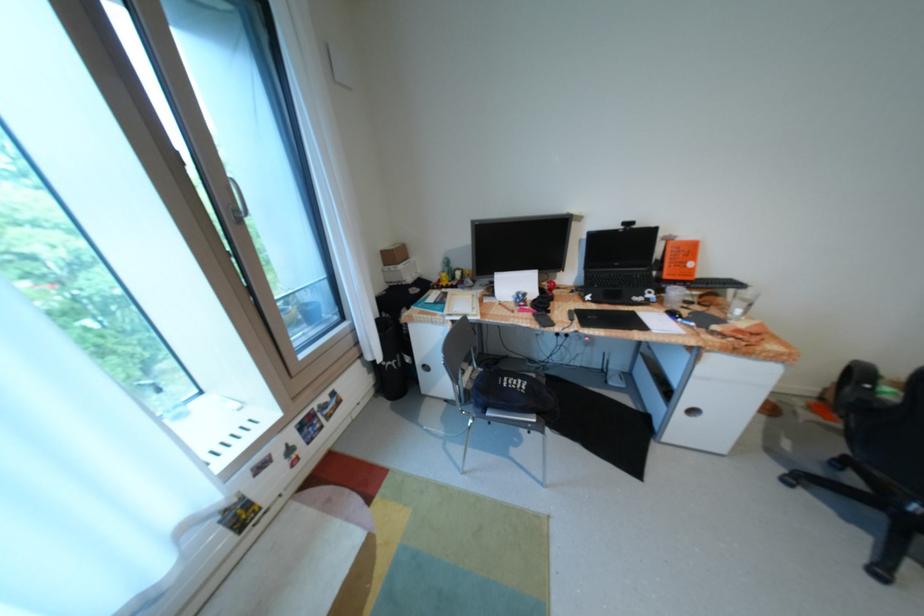
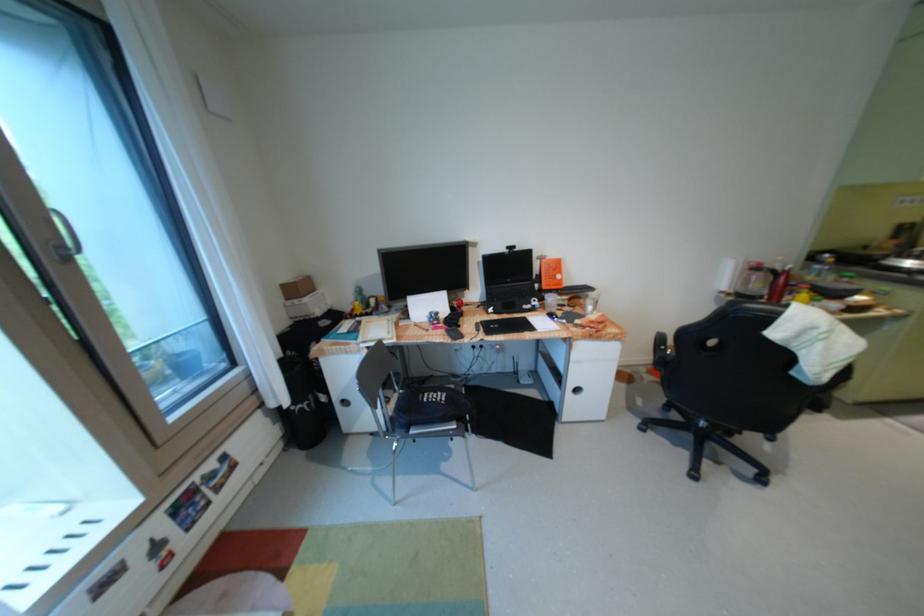
Question: The images are taken continuously from a first-person perspective. In which direction is your viewpoint rotating?

Choices:
 (A) Left
 (B) Right
 (C) Up
 (D) Down

Answer: (B)